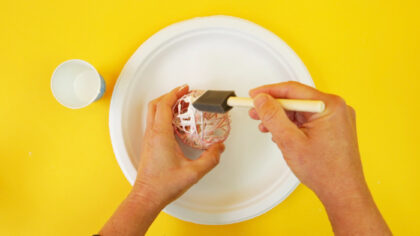
Find the location of a particular element. This screenshot has height=236, width=420. empty space bottom left of plate is located at coordinates (40, 184).